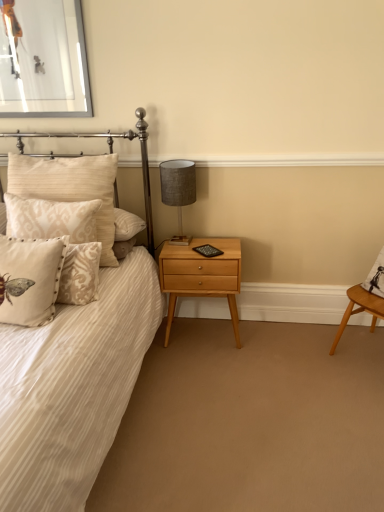
Find the location of `free spot to the right of textured gray lampshade at upper right`. free spot to the right of textured gray lampshade at upper right is located at coordinates (213, 242).